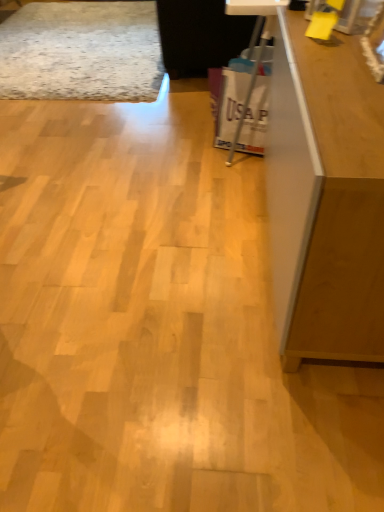
Question: Does matte brown cabinet at right turn towards wooden counter top at upper right?

Choices:
 (A) yes
 (B) no

Answer: (B)

Question: Is matte brown cabinet at right located outside wooden counter top at upper right?

Choices:
 (A) yes
 (B) no

Answer: (A)

Question: Is matte brown cabinet at right far from wooden counter top at upper right?

Choices:
 (A) no
 (B) yes

Answer: (A)

Question: Is matte brown cabinet at right oriented away from wooden counter top at upper right?

Choices:
 (A) yes
 (B) no

Answer: (B)

Question: From the image's perspective, is matte brown cabinet at right over wooden counter top at upper right?

Choices:
 (A) yes
 (B) no

Answer: (B)

Question: Visually, is white plastic bag at center positioned to the left or to the right of matte brown cabinet at right?

Choices:
 (A) right
 (B) left

Answer: (B)

Question: In terms of size, does white plastic bag at center appear bigger or smaller than matte brown cabinet at right?

Choices:
 (A) big
 (B) small

Answer: (B)

Question: Looking at their shapes, would you say white plastic bag at center is wider or thinner than matte brown cabinet at right?

Choices:
 (A) wide
 (B) thin

Answer: (B)

Question: Considering the positions of point (251, 75) and point (289, 262), is point (251, 75) closer or farther from the camera than point (289, 262)?

Choices:
 (A) closer
 (B) farther

Answer: (B)

Question: Is wooden counter top at upper right taller or shorter than white plastic bag at center?

Choices:
 (A) short
 (B) tall

Answer: (B)

Question: From the image's perspective, is wooden counter top at upper right above or below white plastic bag at center?

Choices:
 (A) below
 (B) above

Answer: (B)

Question: Relative to white plastic bag at center, is wooden counter top at upper right in front or behind?

Choices:
 (A) behind
 (B) front

Answer: (B)

Question: Would you say wooden counter top at upper right is to the left or to the right of white plastic bag at center in the picture?

Choices:
 (A) right
 (B) left

Answer: (A)

Question: From a real-world perspective, relative to matte brown cabinet at right, is wooden counter top at upper right vertically above or below?

Choices:
 (A) below
 (B) above

Answer: (B)

Question: Considering the positions of point (286, 46) and point (286, 229), is point (286, 46) closer or farther from the camera than point (286, 229)?

Choices:
 (A) closer
 (B) farther

Answer: (B)